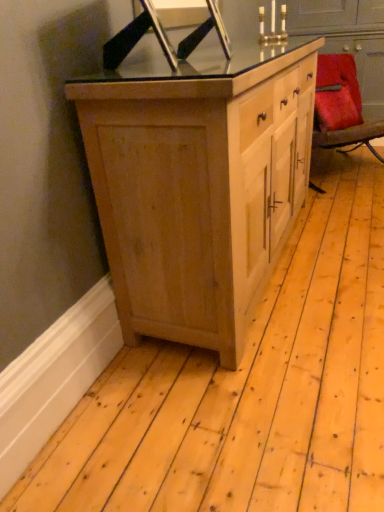
Question: Does metallic gold candle holder at upper center appear on the left side of natural wood cabinet at center?

Choices:
 (A) yes
 (B) no

Answer: (B)

Question: From the image's perspective, would you say metallic gold candle holder at upper center is positioned over natural wood cabinet at center?

Choices:
 (A) no
 (B) yes

Answer: (B)

Question: Is metallic gold candle holder at upper center far from natural wood cabinet at center?

Choices:
 (A) no
 (B) yes

Answer: (B)

Question: Is metallic gold candle holder at upper center positioned before natural wood cabinet at center?

Choices:
 (A) no
 (B) yes

Answer: (A)

Question: Can you confirm if metallic gold candle holder at upper center is bigger than natural wood cabinet at center?

Choices:
 (A) yes
 (B) no

Answer: (B)

Question: Relative to velvet red chair at right, is natural wood cabinet at center in front or behind?

Choices:
 (A) behind
 (B) front

Answer: (B)

Question: Considering the relative positions of natural wood cabinet at center and velvet red chair at right in the image provided, is natural wood cabinet at center to the left or to the right of velvet red chair at right?

Choices:
 (A) right
 (B) left

Answer: (B)

Question: From the image's perspective, is natural wood cabinet at center positioned above or below velvet red chair at right?

Choices:
 (A) above
 (B) below

Answer: (B)

Question: Is natural wood cabinet at center wider or thinner than velvet red chair at right?

Choices:
 (A) wide
 (B) thin

Answer: (A)

Question: Looking at their shapes, would you say metallic gold candle holder at upper center is wider or thinner than natural wood cabinet at center?

Choices:
 (A) wide
 (B) thin

Answer: (B)

Question: From the image's perspective, is metallic gold candle holder at upper center located above or below natural wood cabinet at center?

Choices:
 (A) above
 (B) below

Answer: (A)

Question: Relative to natural wood cabinet at center, is metallic gold candle holder at upper center in front or behind?

Choices:
 (A) behind
 (B) front

Answer: (A)

Question: Looking at the image, does metallic gold candle holder at upper center seem bigger or smaller compared to natural wood cabinet at center?

Choices:
 (A) small
 (B) big

Answer: (A)

Question: Is velvet red chair at right in front of or behind metallic gold candle holder at upper center in the image?

Choices:
 (A) behind
 (B) front

Answer: (A)

Question: Is velvet red chair at right inside the boundaries of metallic gold candle holder at upper center, or outside?

Choices:
 (A) inside
 (B) outside

Answer: (B)